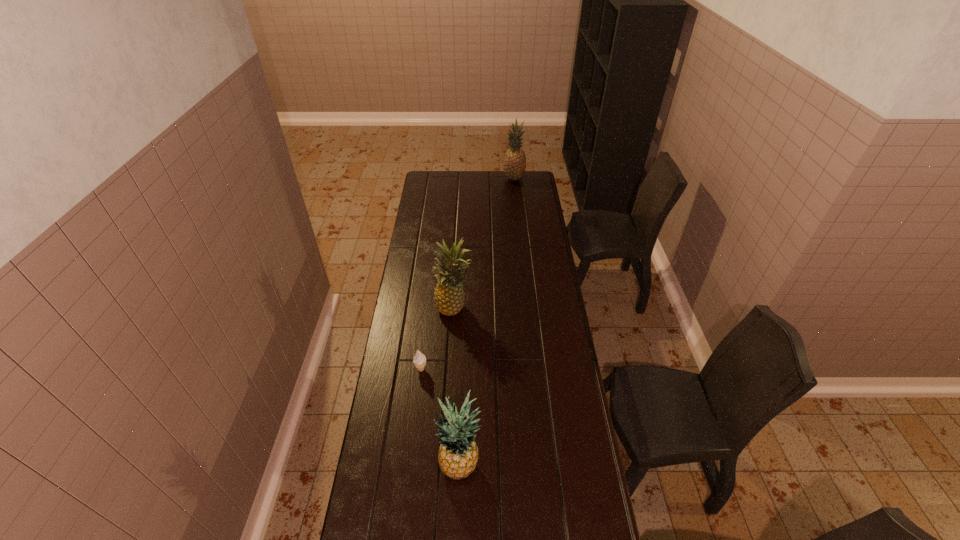
What are the coordinates of `object positioned at the far edge` in the screenshot? It's located at (514, 165).

Where is `object located in the left edge section of the desktop`? object located in the left edge section of the desktop is located at coordinates (419, 360).

The image size is (960, 540). Find the location of `object located in the right edge section of the desktop`. object located in the right edge section of the desktop is located at coordinates (514, 165).

I want to click on object present at the far right corner, so click(514, 165).

Where is `vacant region at the far edge of the desktop`? This screenshot has width=960, height=540. vacant region at the far edge of the desktop is located at coordinates (468, 178).

In order to click on vacant region at the left edge of the desktop in this screenshot , I will do `click(420, 238)`.

I want to click on vacant point at the right edge, so click(568, 497).

I want to click on blank space at the far right corner of the desktop, so tap(537, 186).

You are a GUI agent. You are given a task and a screenshot of the screen. Output one action in this format:
    pyautogui.click(x=<x>, y=<y>)
    Task: Click on the vacant area between the rightmost object and the second nearest pineapple
    This screenshot has width=960, height=540.
    Given the screenshot: What is the action you would take?
    pyautogui.click(x=484, y=244)

Identify the location of unoccupied position between the nearest pineapple and the rightmost pineapple. (487, 323).